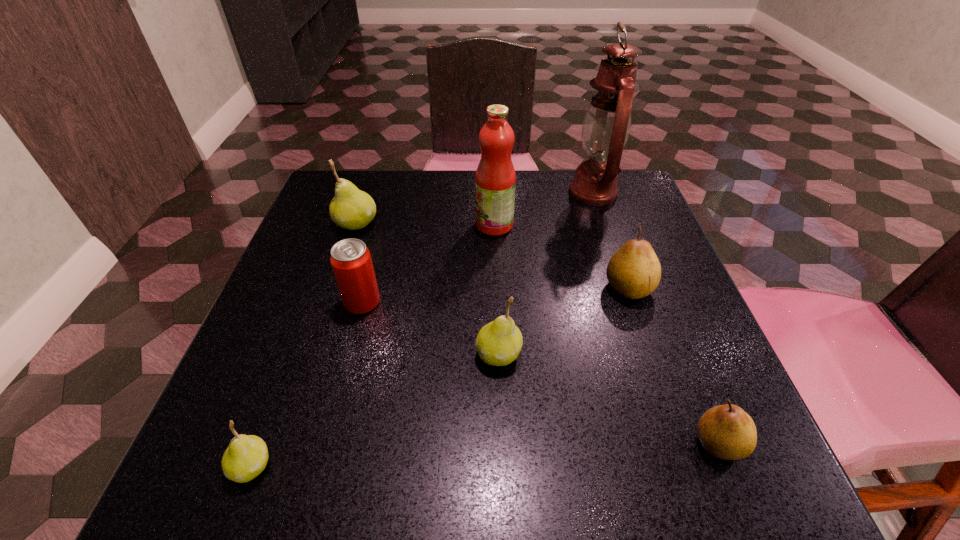
I want to click on the seventh closest object to the nearer brown pear, so click(352, 209).

Where is `pear that is the fourth closest to the smaller brown pear`? pear that is the fourth closest to the smaller brown pear is located at coordinates (352, 209).

Locate which pear is the fourth closest to the tallest pear. Please provide its 2D coordinates. Your answer should be formatted as a tuple, i.e. [(x, y)], where the tuple contains the x and y coordinates of a point satisfying the conditions above.

[(727, 432)]

Where is `green pear that stands as the second closest to the smaller brown pear`? Image resolution: width=960 pixels, height=540 pixels. green pear that stands as the second closest to the smaller brown pear is located at coordinates (246, 457).

Identify the location of green pear that stands as the second closest to the third pear from right to left. (352, 209).

Image resolution: width=960 pixels, height=540 pixels. I want to click on vacant position in the image that satisfies the following two spatial constraints: 1. on the front label of the pink fruit juice; 2. on the front side of the third nearest object, so click(x=499, y=354).

Locate an element on the screen. This screenshot has height=540, width=960. vacant space that satisfies the following two spatial constraints: 1. on the front side of the bigger brown pear; 2. on the left side of the nearer brown pear is located at coordinates (682, 443).

The image size is (960, 540). I want to click on vacant region that satisfies the following two spatial constraints: 1. on the front label of the pink fruit juice; 2. on the back side of the nearer brown pear, so click(x=503, y=443).